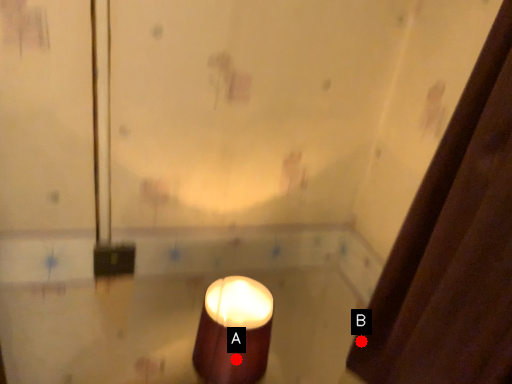
Question: Two points are circled on the image, labeled by A and B beside each circle. Which point is farther from the camera taking this photo?

Choices:
 (A) A is further
 (B) B is further

Answer: (A)